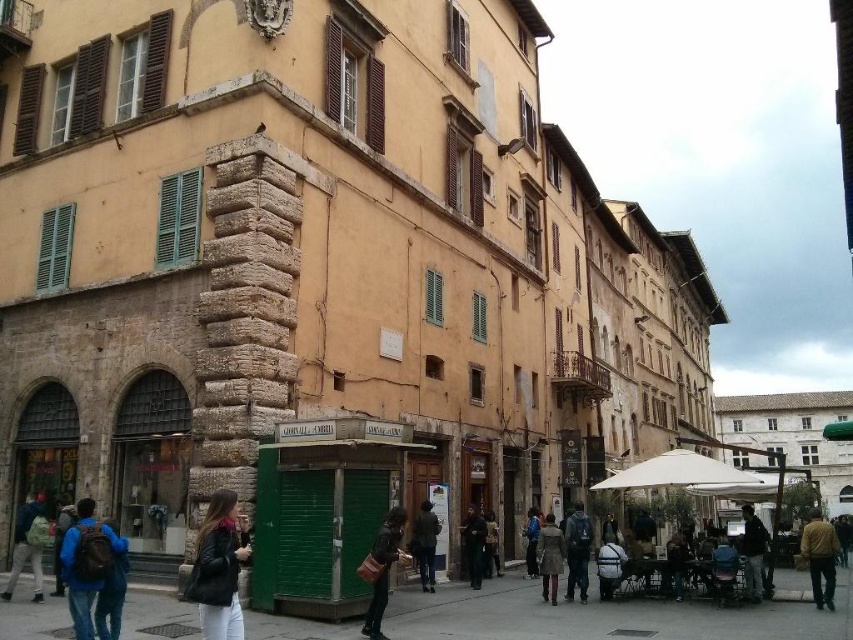
You are a tailor observing the dark brown leather coat at center and the blue denim jacket at lower center in the scene. Which clothing item is shorter in height?

The dark brown leather coat at center is shorter in height compared to the blue denim jacket at lower center.

You are standing on the sidewalk in the historic town and want to take a photo of both the point at coordinates (602,548) and the point at (532,556). Which point should you focus on first to ensure both are in clear view?

You should focus on point (602,548) first because it is closer to you than point (532,556), ensuring both points are in clear view when focused on the nearer one.